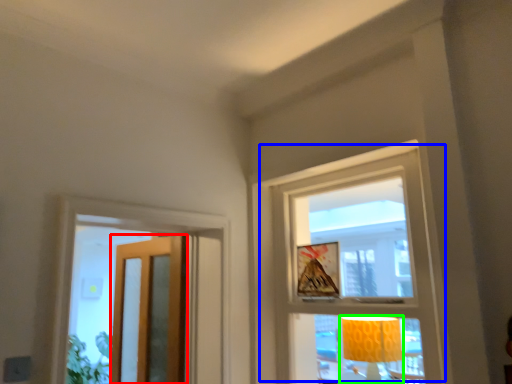
Question: Which object is positioned farthest from door (highlighted by a red box)? Select from window (highlighted by a blue box) and table lamp (highlighted by a green box).

Choices:
 (A) window
 (B) table lamp

Answer: (B)